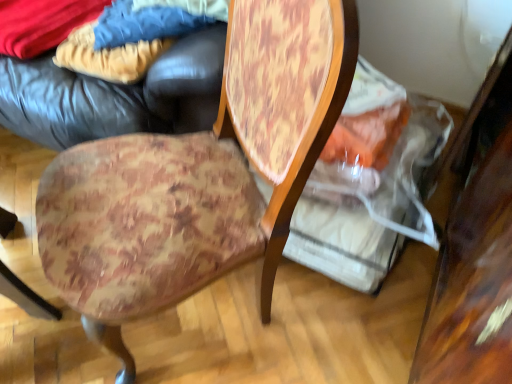
Question: Is velvet-like beige pants at upper left, the 2th fabric when ordered from right to left, looking in the opposite direction of wooden table at right?

Choices:
 (A) yes
 (B) no

Answer: (B)

Question: Is wooden table at right completely or partially inside velvet-like beige pants at upper left, the 2th fabric when ordered from right to left?

Choices:
 (A) no
 (B) yes

Answer: (A)

Question: From a real-world perspective, is velvet-like beige pants at upper left, the second fabric viewed from the left, located beneath wooden table at right?

Choices:
 (A) no
 (B) yes

Answer: (A)

Question: Does velvet-like beige pants at upper left, the 2th fabric when ordered from right to left, appear on the right side of wooden table at right?

Choices:
 (A) no
 (B) yes

Answer: (A)

Question: Is velvet-like beige pants at upper left, the 2th fabric when ordered from right to left, shorter than wooden table at right?

Choices:
 (A) yes
 (B) no

Answer: (A)

Question: From a real-world perspective, is velvet-like beige pants at upper left, the 2th fabric when ordered from right to left, physically above wooden table at right?

Choices:
 (A) yes
 (B) no

Answer: (A)

Question: Is blue denim jeans at upper left, the 3th fabric positioned from the left, surrounding velvet-like beige pants at upper left, the 2th fabric when ordered from right to left?

Choices:
 (A) no
 (B) yes

Answer: (A)

Question: Are blue denim jeans at upper left, the first fabric positioned from the right, and velvet-like beige pants at upper left, the second fabric viewed from the left, located far from each other?

Choices:
 (A) yes
 (B) no

Answer: (B)

Question: Is blue denim jeans at upper left, the first fabric positioned from the right, oriented away from velvet-like beige pants at upper left, the 2th fabric when ordered from right to left?

Choices:
 (A) no
 (B) yes

Answer: (B)

Question: Considering the relative sizes of blue denim jeans at upper left, the 3th fabric positioned from the left, and velvet-like beige pants at upper left, the second fabric viewed from the left, in the image provided, is blue denim jeans at upper left, the 3th fabric positioned from the left, wider than velvet-like beige pants at upper left, the second fabric viewed from the left,?

Choices:
 (A) no
 (B) yes

Answer: (A)

Question: Considering the relative positions of blue denim jeans at upper left, the 3th fabric positioned from the left, and velvet-like beige pants at upper left, the 2th fabric when ordered from right to left, in the image provided, is blue denim jeans at upper left, the 3th fabric positioned from the left, behind velvet-like beige pants at upper left, the 2th fabric when ordered from right to left,?

Choices:
 (A) no
 (B) yes

Answer: (A)

Question: From a real-world perspective, does blue denim jeans at upper left, the first fabric positioned from the right, stand above velvet-like beige pants at upper left, the second fabric viewed from the left?

Choices:
 (A) no
 (B) yes

Answer: (B)

Question: Is velvety blue blanket at upper left, the first fabric from the left, wider than blue denim jeans at upper left, the first fabric positioned from the right?

Choices:
 (A) yes
 (B) no

Answer: (A)